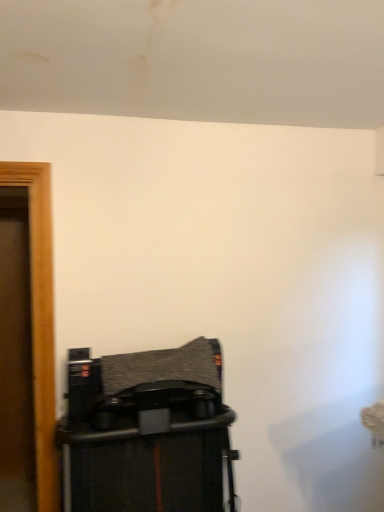
This screenshot has height=512, width=384. What do you see at coordinates (147, 432) in the screenshot? I see `matte black treadmill at lower left` at bounding box center [147, 432].

The width and height of the screenshot is (384, 512). I want to click on matte black treadmill at lower left, so click(147, 432).

I want to click on matte black treadmill at lower left, so click(x=147, y=432).